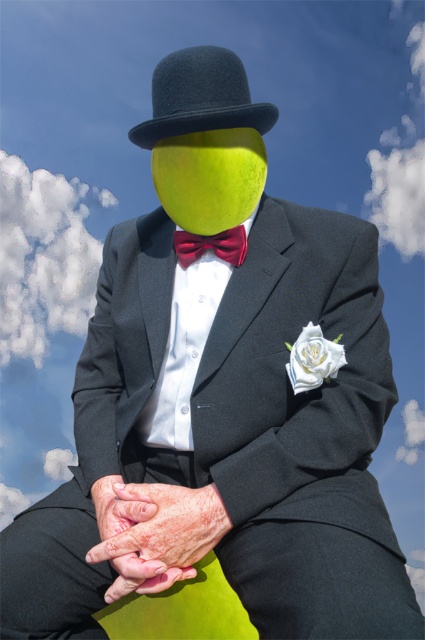
Question: Which of the following is the closest to the observer?

Choices:
 (A) (238, 60)
 (B) (189, 243)

Answer: (A)

Question: Can you confirm if black felt fedora at center is smaller than shiny red bow tie at center?

Choices:
 (A) yes
 (B) no

Answer: (B)

Question: Is black felt fedora at center wider than shiny red bow tie at center?

Choices:
 (A) no
 (B) yes

Answer: (B)

Question: Can you confirm if black felt fedora at center is smaller than shiny red bow tie at center?

Choices:
 (A) no
 (B) yes

Answer: (A)